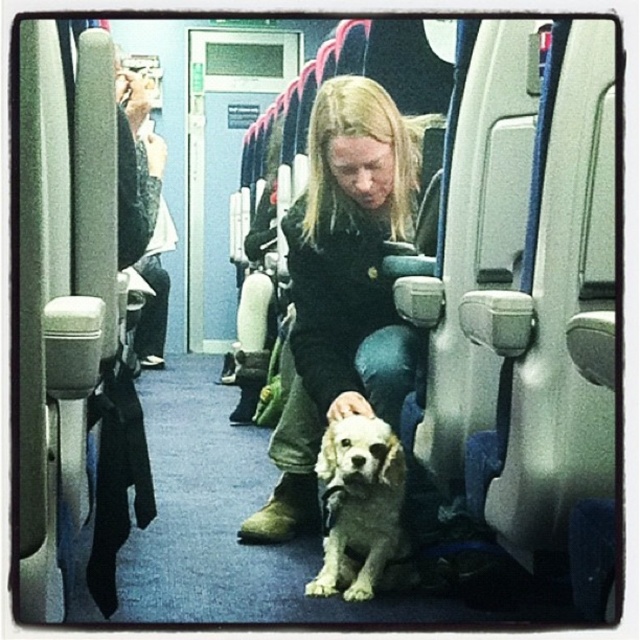
Question: Does matte black jacket at center appear under white fur dog at center?

Choices:
 (A) yes
 (B) no

Answer: (B)

Question: Can you confirm if matte black jacket at center is smaller than white fur dog at center?

Choices:
 (A) no
 (B) yes

Answer: (A)

Question: Can you confirm if matte black jacket at center is smaller than white fur dog at center?

Choices:
 (A) yes
 (B) no

Answer: (B)

Question: Among these objects, which one is nearest to the camera?

Choices:
 (A) white fur dog at center
 (B) matte black jacket at center

Answer: (B)

Question: Which point is closer to the camera?

Choices:
 (A) tap(292, 212)
 (B) tap(326, 481)

Answer: (B)